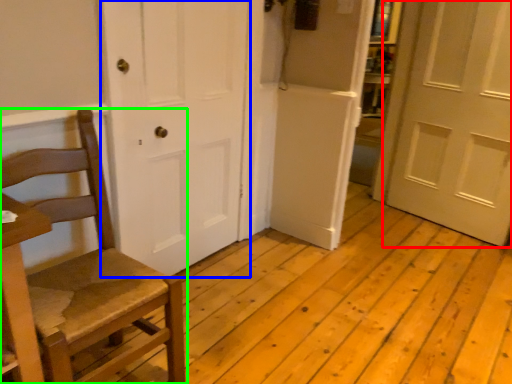
Question: Which is nearer to the door (highlighted by a red box)? door (highlighted by a blue box) or chair (highlighted by a green box).

Choices:
 (A) door
 (B) chair

Answer: (A)